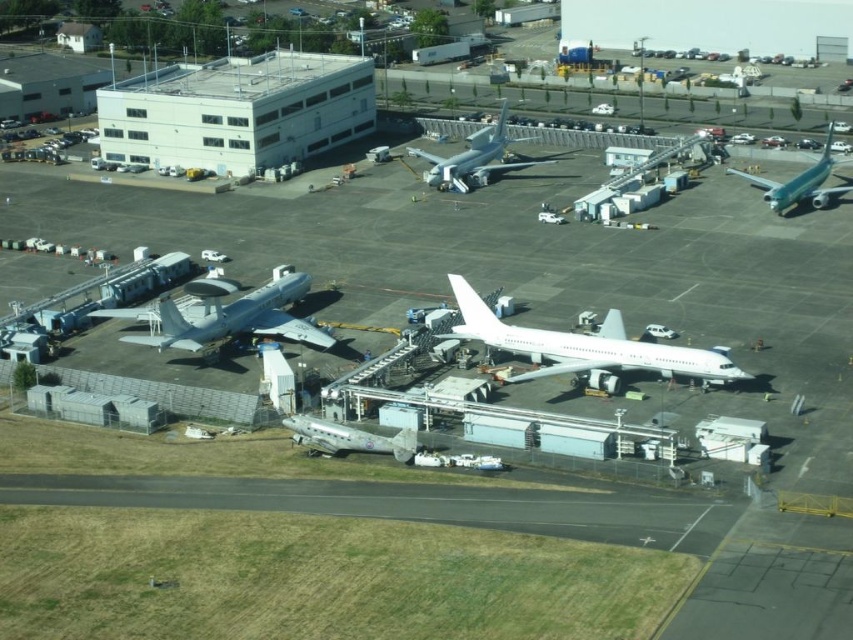
Is point (496, 168) positioned before point (322, 448)?

No, it is not.

Is white glossy airplane at center wider than metallic silver airplane at center?

Yes.

Does point (467, 186) lie behind point (309, 429)?

That is True.

Find the location of a particular element. The image size is (853, 640). white glossy airplane at center is located at coordinates (474, 157).

What do you see at coordinates (582, 346) in the screenshot? I see `white matte airplane at center` at bounding box center [582, 346].

Who is more forward, [611,356] or [824,202]?

Positioned in front is point [611,356].

Who is more distant from viewer, (636, 358) or (824, 198)?

The point (824, 198) is more distant.

This screenshot has width=853, height=640. In order to click on white matte airplane at center in this screenshot , I will do `click(582, 346)`.

At what (x,y) coordinates should I click in order to perform the action: click on black asphalt runway at lower center. Please return your answer as a coordinate pair (x, y). The height and width of the screenshot is (640, 853). Looking at the image, I should click on (409, 504).

Consider the image. Who is taller, black asphalt runway at lower center or white glossy airplane at center?

Standing taller between the two is white glossy airplane at center.

Is point (612, 528) farther from viewer compared to point (541, 163)?

No, (612, 528) is in front of (541, 163).

The image size is (853, 640). Find the location of `black asphalt runway at lower center`. black asphalt runway at lower center is located at coordinates (409, 504).